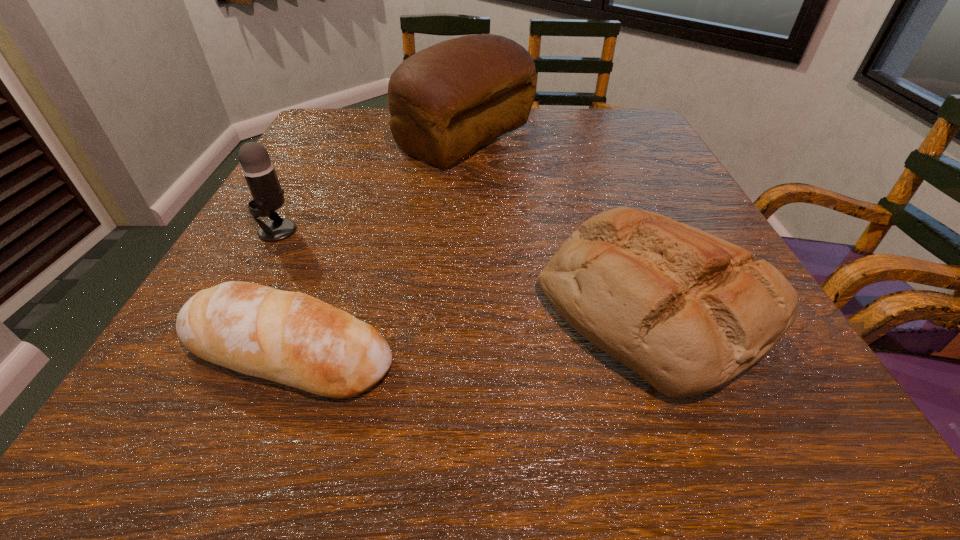
I want to click on blank space at the near left corner of the desktop, so click(x=220, y=436).

Identify the location of vacant space at the far right corner. Image resolution: width=960 pixels, height=540 pixels. (601, 127).

This screenshot has height=540, width=960. In order to click on vacant space at the near right corner of the desktop in this screenshot , I will do `click(746, 452)`.

This screenshot has width=960, height=540. What are the coordinates of `free space between the shortest object and the second shortest object` in the screenshot? It's located at [x=471, y=329].

At what (x,y) coordinates should I click in order to perform the action: click on vacant point located between the second shortest bread and the shortest object. Please return your answer as a coordinate pair (x, y). The height and width of the screenshot is (540, 960). Looking at the image, I should click on (471, 329).

Locate an element on the screen. This screenshot has width=960, height=540. vacant point located between the farthest bread and the second tallest object is located at coordinates (372, 184).

The height and width of the screenshot is (540, 960). I want to click on free space between the second tallest object and the second tallest bread, so click(x=466, y=268).

You are a GUI agent. You are given a task and a screenshot of the screen. Output one action in this format:
    pyautogui.click(x=<x>, y=<y>)
    Task: Click on the empty space that is in between the second shortest bread and the shortest object
    
    Given the screenshot: What is the action you would take?
    pyautogui.click(x=471, y=329)

This screenshot has width=960, height=540. I want to click on vacant area between the second shortest object and the tallest bread, so click(x=560, y=222).

Find the location of a particular element. The width and height of the screenshot is (960, 540). vacant area between the shortest bread and the tallest object is located at coordinates (377, 245).